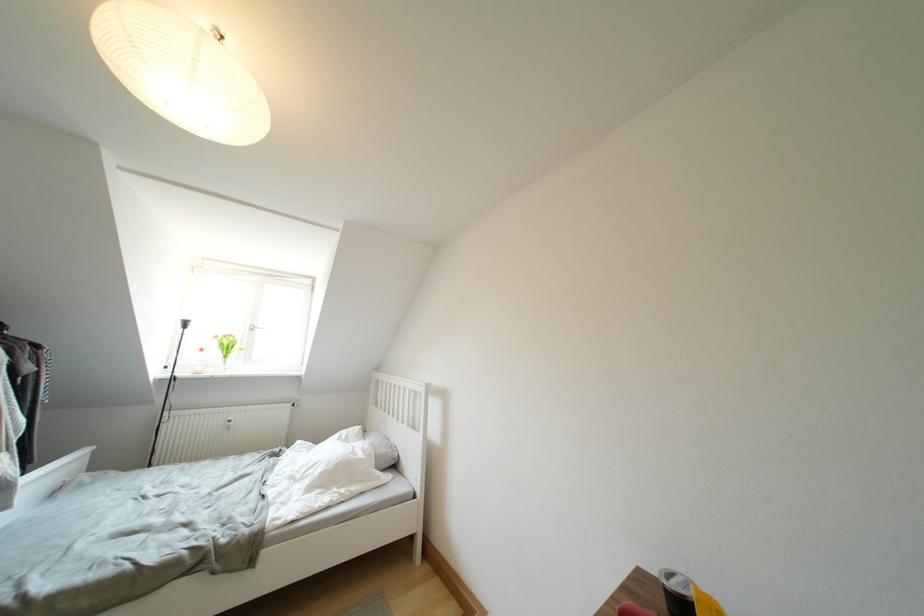
You are a GUI agent. You are given a task and a screenshot of the screen. Output one action in this format:
    pyautogui.click(x=<x>, y=<y>)
    Task: Click on the white pillow
    
    Given the screenshot: What is the action you would take?
    pyautogui.click(x=382, y=450)